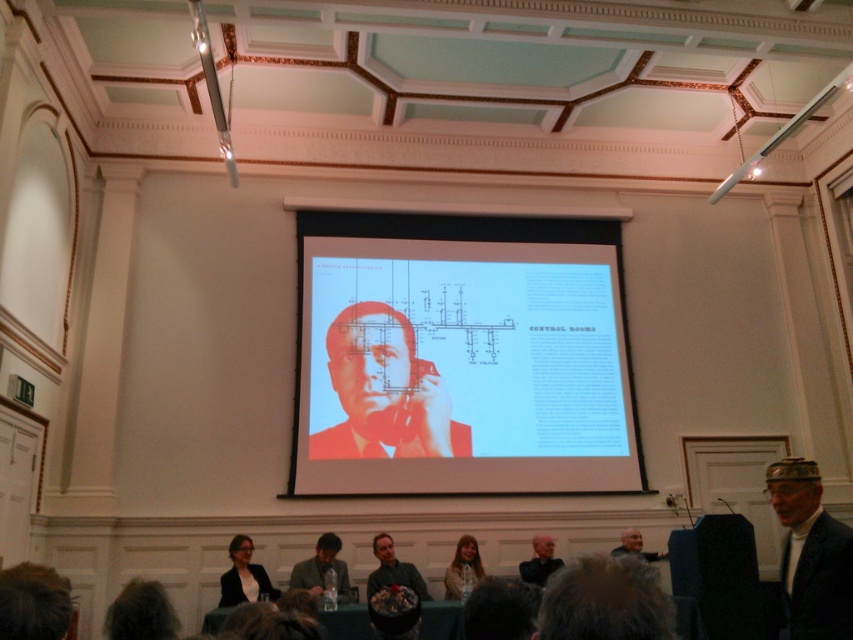
Between point (709, 548) and point (238, 561), which one is positioned behind?

Positioned behind is point (238, 561).

Measure the distance between dark blue fabric at lower right and camera.

dark blue fabric at lower right is 17.26 feet away from camera.

Locate an element on the screen. This screenshot has width=853, height=640. dark blue fabric at lower right is located at coordinates (718, 573).

Can you confirm if dark blue fabric at lower right is wider than matte gray suit at center?

Correct, the width of dark blue fabric at lower right exceeds that of matte gray suit at center.

You are a GUI agent. You are given a task and a screenshot of the screen. Output one action in this format:
    pyautogui.click(x=<x>, y=<y>)
    Task: Click on the dark blue fabric at lower right
    The width and height of the screenshot is (853, 640).
    Given the screenshot: What is the action you would take?
    pyautogui.click(x=718, y=573)

I want to click on dark blue fabric at lower right, so click(x=718, y=573).

Is light brown hair at lower center below dark gray suit at lower center?

Yes, light brown hair at lower center is below dark gray suit at lower center.

Between light brown hair at lower center and dark gray suit at lower center, which one has less height?

dark gray suit at lower center is shorter.

I want to click on light brown hair at lower center, so click(462, 566).